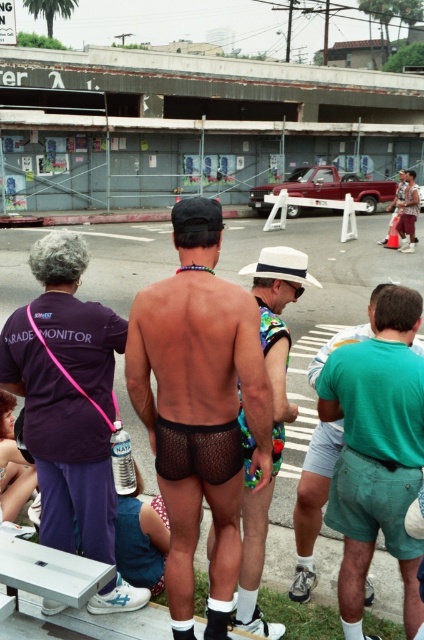
Question: Considering the real-world distances, which object is farthest from the white plastic picnic table at lower left?

Choices:
 (A) green fabric shorts at lower right
 (B) fishnet shorts at center
 (C) black mesh shorts at center

Answer: (A)

Question: Does fishnet shorts at center lie behind white plastic picnic table at lower left?

Choices:
 (A) no
 (B) yes

Answer: (B)

Question: From the image, what is the correct spatial relationship of black mesh underwear at center in relation to fishnet shorts at center?

Choices:
 (A) below
 (B) above

Answer: (B)

Question: Is fishnet shorts at center wider than green fabric shorts at lower right?

Choices:
 (A) yes
 (B) no

Answer: (A)

Question: Based on their relative distances, which object is farther from the white plastic picnic table at lower left?

Choices:
 (A) black mesh shorts at center
 (B) fishnet shorts at center
 (C) green fabric shorts at lower right

Answer: (C)

Question: Based on their relative distances, which object is farther from the black mesh underwear at center?

Choices:
 (A) green fabric shorts at lower right
 (B) black mesh shorts at center
 (C) fishnet shorts at center

Answer: (A)